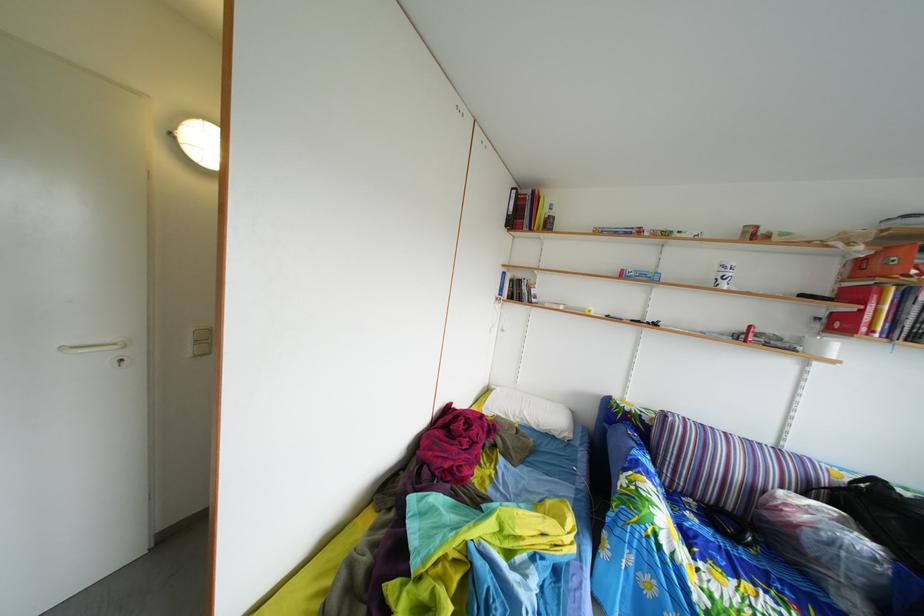
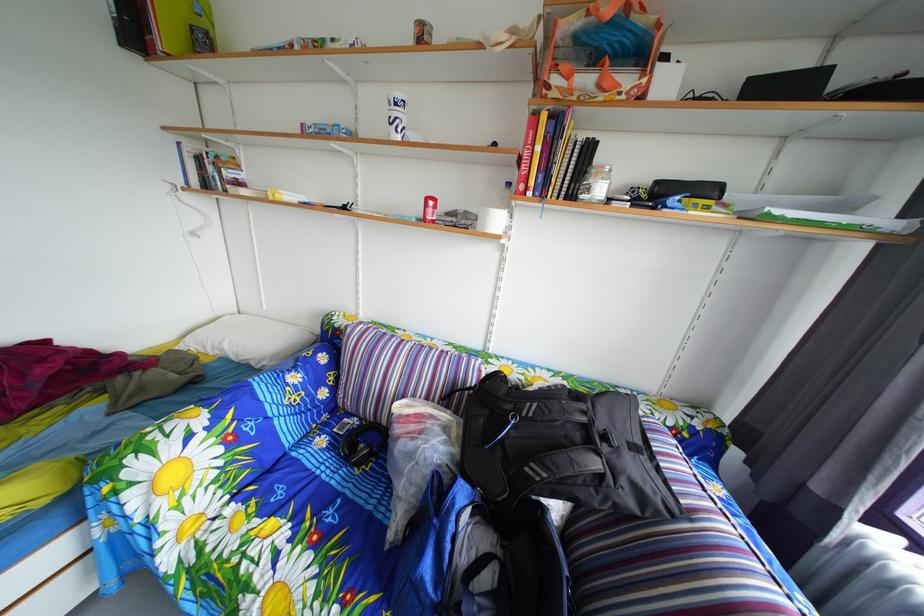
Locate, in the second image, the point that corresponds to (x=731, y=562) in the first image.

(301, 493)